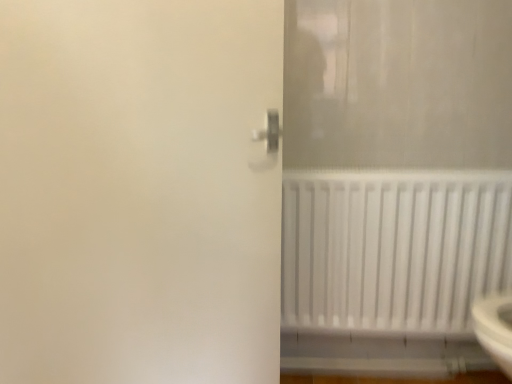
Question: Is point (14, 117) positioned closer to the camera than point (309, 200)?

Choices:
 (A) farther
 (B) closer

Answer: (B)

Question: From a real-world perspective, is white matte screen door at center positioned above or below white matte radiator at lower right?

Choices:
 (A) below
 (B) above

Answer: (B)

Question: From their relative heights in the image, would you say white matte screen door at center is taller or shorter than white matte radiator at lower right?

Choices:
 (A) tall
 (B) short

Answer: (A)

Question: From a real-world perspective, is white matte radiator at lower right physically located above or below white matte screen door at center?

Choices:
 (A) below
 (B) above

Answer: (A)

Question: Looking at the image, does white matte radiator at lower right seem bigger or smaller compared to white matte screen door at center?

Choices:
 (A) small
 (B) big

Answer: (A)

Question: Is white matte radiator at lower right in front of or behind white matte screen door at center in the image?

Choices:
 (A) front
 (B) behind

Answer: (B)

Question: From the image's perspective, is white matte radiator at lower right above or below white matte screen door at center?

Choices:
 (A) above
 (B) below

Answer: (B)